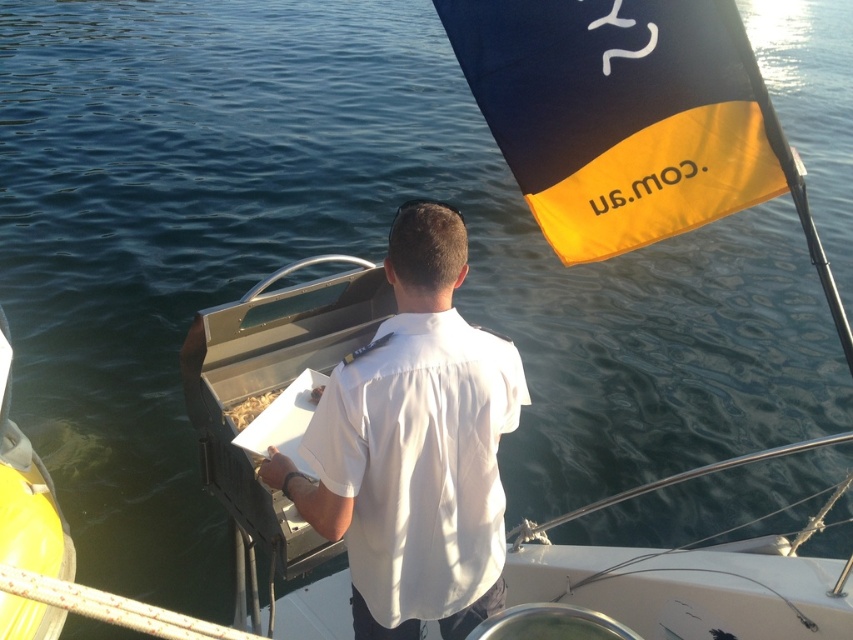
Question: Considering the relative positions of black/yellow fabric flag at upper right and white cotton shirt at center in the image provided, where is black/yellow fabric flag at upper right located with respect to white cotton shirt at center?

Choices:
 (A) above
 (B) below

Answer: (A)

Question: Is black/yellow fabric flag at upper right wider than white cotton shirt at center?

Choices:
 (A) yes
 (B) no

Answer: (A)

Question: Which of the following is the closest to the observer?

Choices:
 (A) black/yellow fabric flag at upper right
 (B) white cotton shirt at center

Answer: (B)

Question: Is black/yellow fabric flag at upper right positioned behind white cotton shirt at center?

Choices:
 (A) no
 (B) yes

Answer: (B)

Question: Among these points, which one is farthest from the camera?

Choices:
 (A) (554, 243)
 (B) (387, 570)

Answer: (A)